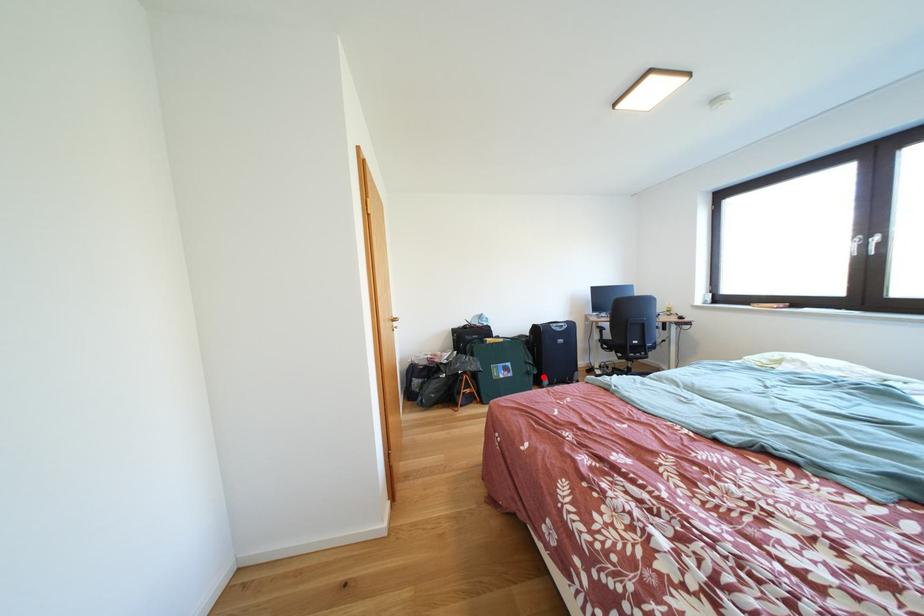
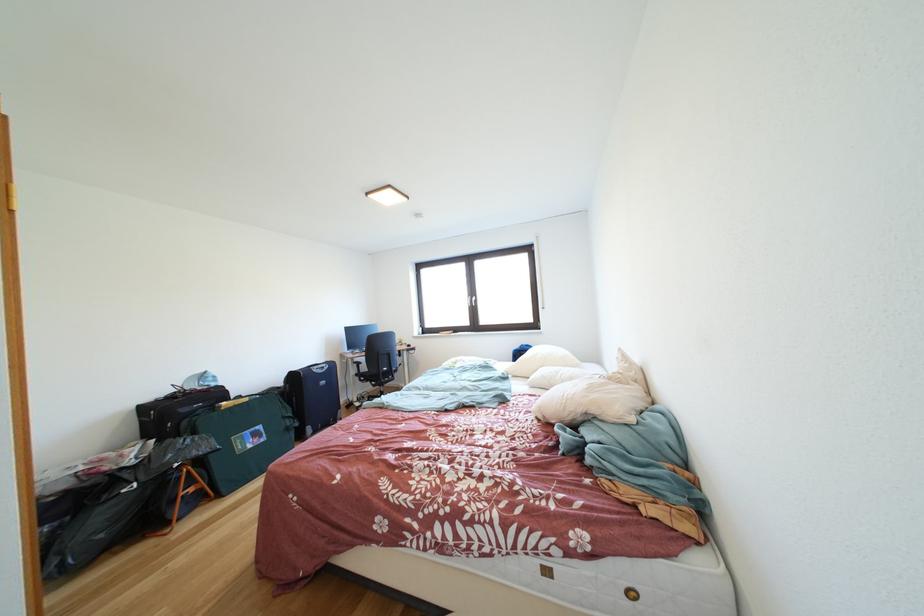
The point at the highlighted location is marked in the first image. Where is the corresponding point in the second image?

(306, 429)